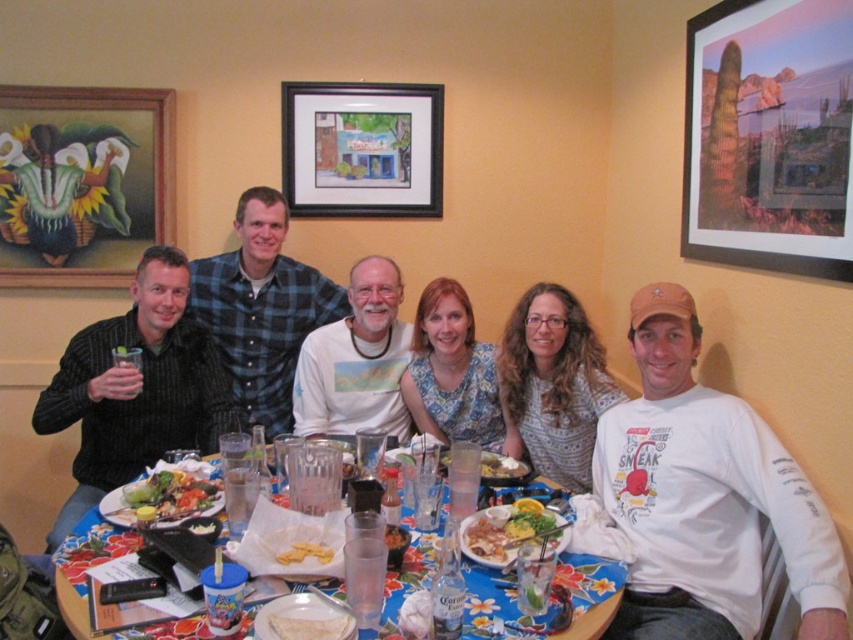
Question: Which object appears closest to the camera in this image?

Choices:
 (A) white cotton shirt at center
 (B) white t-shirt at center
 (C) black striped shirt at left

Answer: (A)

Question: Does wooden framed painting at upper left have a lesser width compared to fresh green salad at center?

Choices:
 (A) yes
 (B) no

Answer: (B)

Question: Which object appears farthest from the camera in this image?

Choices:
 (A) fresh green salad at center
 (B) white t-shirt at center
 (C) white cotton t-shirt at center
 (D) yellow matte chips at center

Answer: (C)

Question: Can you confirm if white printed t-shirt at center is bigger than yellow matte chips at center?

Choices:
 (A) no
 (B) yes

Answer: (B)

Question: Does wooden framed painting at upper left have a larger size compared to white printed t-shirt at center?

Choices:
 (A) yes
 (B) no

Answer: (A)

Question: Which point is farther from the camera taking this photo?

Choices:
 (A) (521, 385)
 (B) (440, 388)
 (C) (22, 122)
 (D) (840, 260)

Answer: (C)